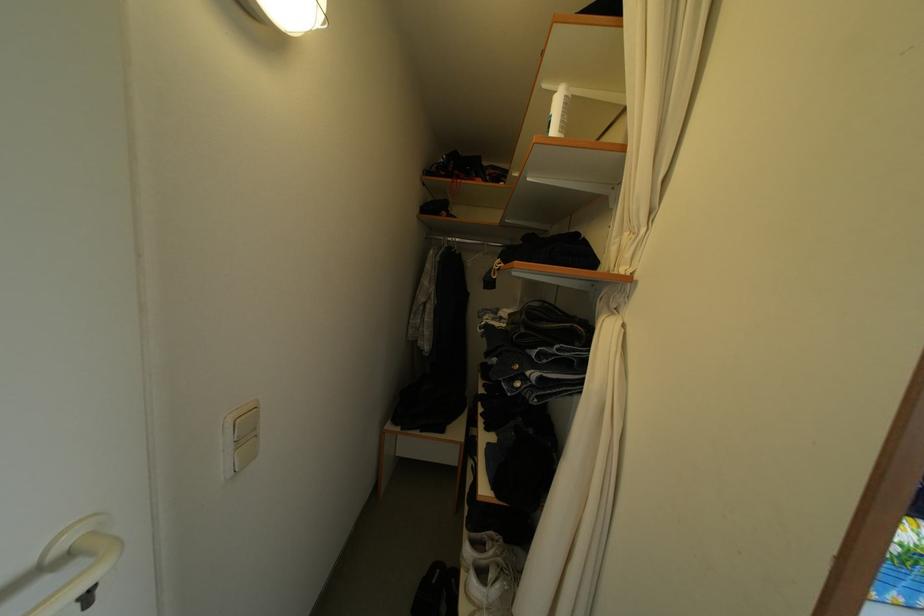
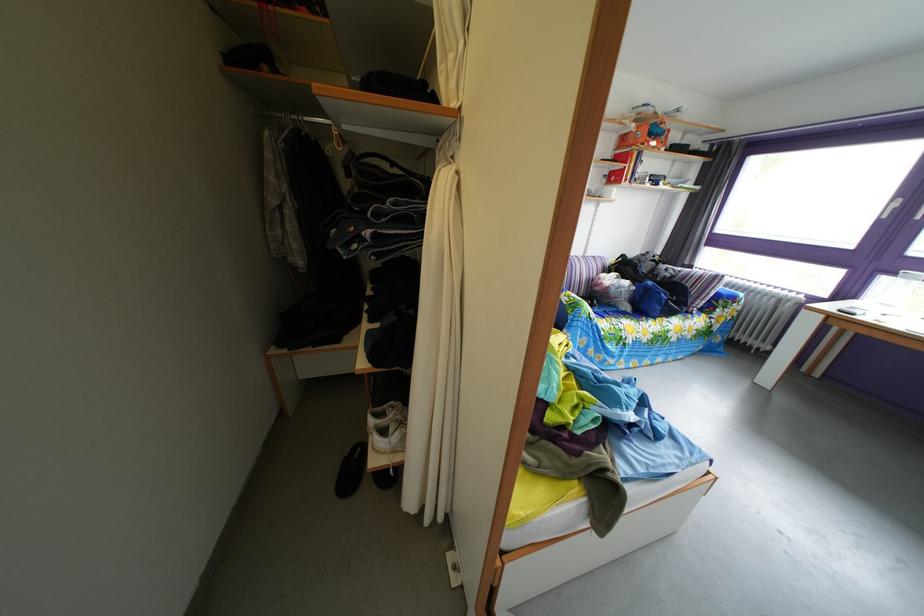
Question: Which direction would the cameraman need to move to produce the second image? Reply with the corresponding letter.

Choices:
 (A) Left
 (B) Right
 (C) Forward
 (D) Backward

Answer: (B)